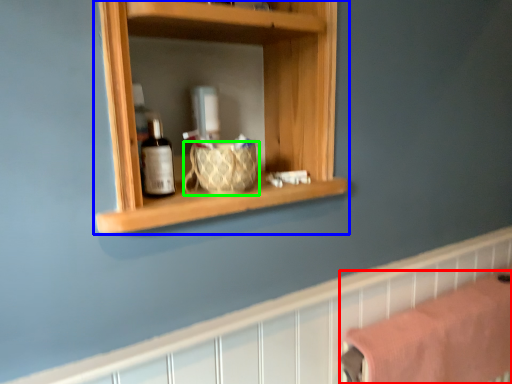
Question: Which object is the farthest from bath towel (highlighted by a red box)? Choose among these: shelf (highlighted by a blue box) or basket (highlighted by a green box).

Choices:
 (A) shelf
 (B) basket

Answer: (B)